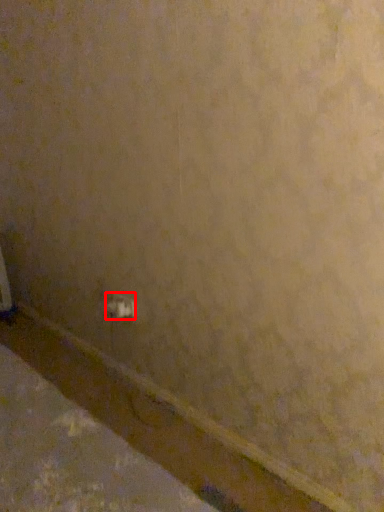
Question: Where is power plugs and sockets (annotated by the red box) located in relation to molding in the image?

Choices:
 (A) left
 (B) right

Answer: (B)